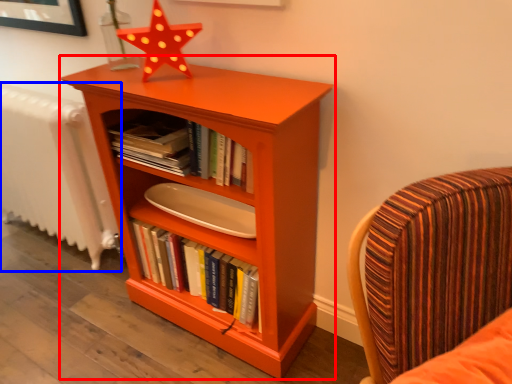
Question: Among these objects, which one is farthest to the camera, bookcase (highlighted by a red box) or radiator (highlighted by a blue box)?

Choices:
 (A) bookcase
 (B) radiator

Answer: (B)